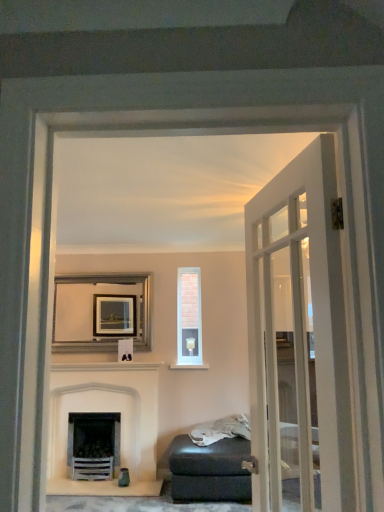
Question: Should I look upward or downward to see white glass door at right?

Choices:
 (A) up
 (B) down

Answer: (B)

Question: Does silver metallic picture frame at center have a smaller size compared to white stone fireplace at lower left?

Choices:
 (A) no
 (B) yes

Answer: (B)

Question: Is the depth of silver metallic picture frame at center less than that of white stone fireplace at lower left?

Choices:
 (A) no
 (B) yes

Answer: (A)

Question: Considering the relative sizes of silver metallic picture frame at center and white stone fireplace at lower left in the image provided, is silver metallic picture frame at center thinner than white stone fireplace at lower left?

Choices:
 (A) no
 (B) yes

Answer: (B)

Question: Is silver metallic picture frame at center in contact with white stone fireplace at lower left?

Choices:
 (A) yes
 (B) no

Answer: (B)

Question: Does silver metallic picture frame at center have a greater width compared to white stone fireplace at lower left?

Choices:
 (A) yes
 (B) no

Answer: (B)

Question: Are silver metallic picture frame at center and white stone fireplace at lower left located far from each other?

Choices:
 (A) yes
 (B) no

Answer: (B)

Question: From a real-world perspective, is silver metallic picture frame at center beneath white glass door at right?

Choices:
 (A) no
 (B) yes

Answer: (A)

Question: Would you say silver metallic picture frame at center is outside white glass door at right?

Choices:
 (A) yes
 (B) no

Answer: (A)

Question: Is silver metallic picture frame at center positioned before white glass door at right?

Choices:
 (A) yes
 (B) no

Answer: (B)

Question: Is silver metallic picture frame at center to the left of white glass door at right from the viewer's perspective?

Choices:
 (A) yes
 (B) no

Answer: (A)

Question: Does silver metallic picture frame at center have a smaller size compared to white glass door at right?

Choices:
 (A) yes
 (B) no

Answer: (A)

Question: Can you confirm if silver metallic picture frame at center is positioned to the right of white glass door at right?

Choices:
 (A) yes
 (B) no

Answer: (B)

Question: Is silver metallic picture frame at center oriented towards matte black ottoman at lower center?

Choices:
 (A) no
 (B) yes

Answer: (A)